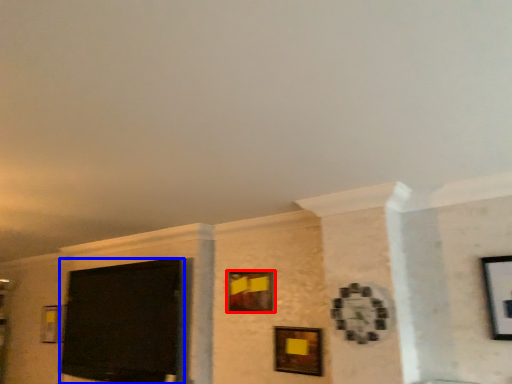
Question: Which point is closer to the camera, picture frame (highlighted by a red box) or projection screen (highlighted by a blue box)?

Choices:
 (A) picture frame
 (B) projection screen

Answer: (A)